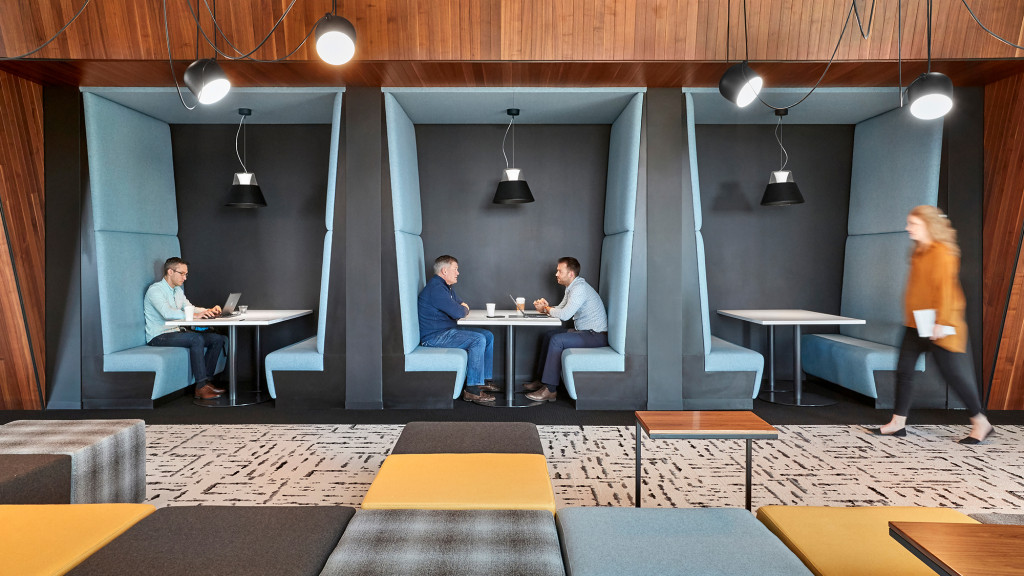
Locate an element on the screen. The height and width of the screenshot is (576, 1024). light fixture is located at coordinates (511, 192).